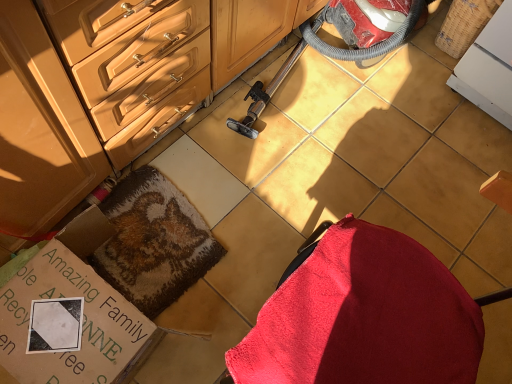
Identify the location of blank area beneath red plastic vacuum cleaner at center (from a real-world perspective). (339, 102).